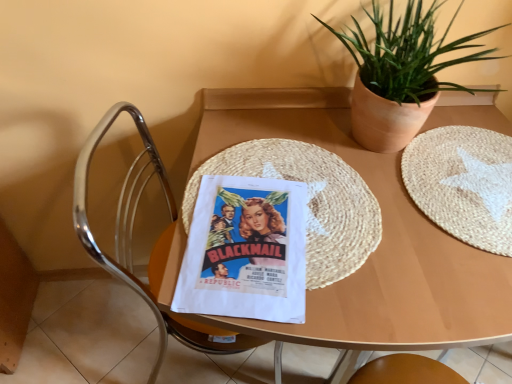
Locate an element on the screen. vacant area that lies between green leafy plant in clay pot at upper right and matte paper poster at center is located at coordinates (344, 202).